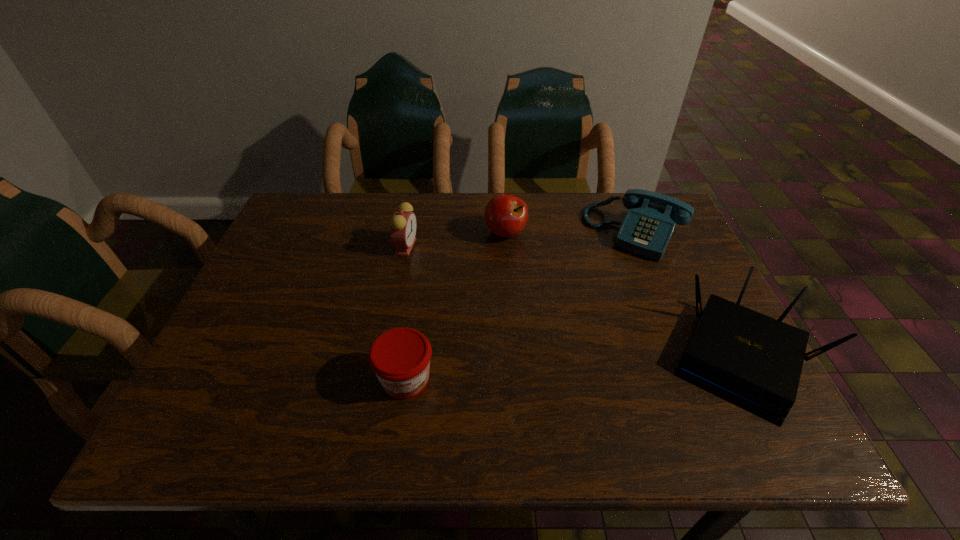
At what (x,y) coordinates should I click in order to perform the action: click on jam. Please return your answer as a coordinate pair (x, y). The width and height of the screenshot is (960, 540). Looking at the image, I should click on (400, 357).

Image resolution: width=960 pixels, height=540 pixels. What are the coordinates of `router` in the screenshot? It's located at (753, 361).

I want to click on alarm clock, so click(403, 224).

The width and height of the screenshot is (960, 540). I want to click on the third object from right to left, so click(x=506, y=215).

Locate an element on the screen. The width and height of the screenshot is (960, 540). telephone is located at coordinates (646, 230).

Locate an element on the screen. This screenshot has height=540, width=960. vacant space located 0.080m on the back of the router is located at coordinates (704, 282).

Image resolution: width=960 pixels, height=540 pixels. I want to click on vacant space located 0.210m on the face of the alarm clock, so click(x=459, y=300).

Identify the location of vacant space located on the face of the alarm clock. (451, 293).

At what (x,y) coordinates should I click in order to perform the action: click on vacant space located on the face of the alarm clock. Please return your answer as a coordinate pair (x, y). This screenshot has width=960, height=540. Looking at the image, I should click on (505, 344).

Find the location of a particular element. This screenshot has height=540, width=960. free space located 0.330m on the stem of the third object from right to left is located at coordinates (529, 343).